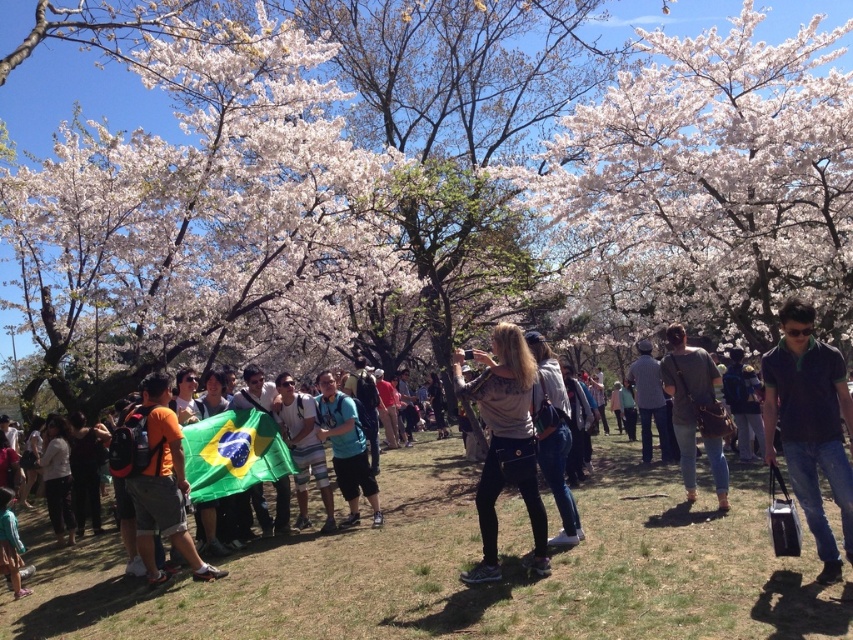
You are standing in the cherry blossom park and want to take a photo of both the point at coordinates (193, 476) and the point at coordinates (637, 381). Which point should you focus on first to ensure both are in focus?

You should focus on the point at coordinates (193, 476) first because it is closer to the camera than the point at coordinates (637, 381). This way, both points will be in focus when using depth of field appropriately.